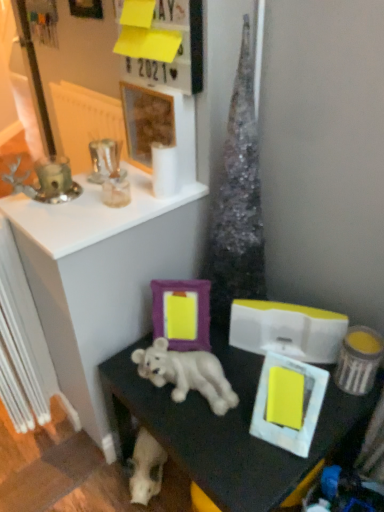
Question: Is metallic silver picture frame at upper left, which is the 4th picture frame in front-to-back order, oriented away from white matte skull at lower center?

Choices:
 (A) no
 (B) yes

Answer: (A)

Question: Is the position of metallic silver picture frame at upper left, which appears as the 1th picture frame when viewed from the back, more distant than that of white matte skull at lower center?

Choices:
 (A) no
 (B) yes

Answer: (B)

Question: Is white matte skull at lower center inside metallic silver picture frame at upper left, which is counted as the 1th picture frame, starting from the left?

Choices:
 (A) no
 (B) yes

Answer: (A)

Question: From the image's perspective, would you say metallic silver picture frame at upper left, which is the 4th picture frame in front-to-back order, is shown under white matte skull at lower center?

Choices:
 (A) yes
 (B) no

Answer: (B)

Question: From a real-world perspective, is metallic silver picture frame at upper left, which is counted as the 1th picture frame, starting from the left, positioned under white matte skull at lower center based on gravity?

Choices:
 (A) yes
 (B) no

Answer: (B)

Question: From the image's perspective, is metallic silver picture frame at upper left, which appears as the 1th picture frame when viewed from the back, located above white matte skull at lower center?

Choices:
 (A) no
 (B) yes

Answer: (B)

Question: Could you tell me if wooden frame at upper center, placed as the 2th picture frame when sorted from top to bottom, is facing silver metallic candle holder at upper left?

Choices:
 (A) yes
 (B) no

Answer: (A)

Question: Is the depth of wooden frame at upper center, acting as the 3th picture frame starting from the back, greater than that of silver metallic candle holder at upper left?

Choices:
 (A) yes
 (B) no

Answer: (A)

Question: Considering the relative sizes of wooden frame at upper center, acting as the 3th picture frame starting from the back, and silver metallic candle holder at upper left in the image provided, is wooden frame at upper center, acting as the 3th picture frame starting from the back, smaller than silver metallic candle holder at upper left?

Choices:
 (A) no
 (B) yes

Answer: (A)

Question: Considering the relative sizes of wooden frame at upper center, which appears as the third picture frame when viewed from the right, and silver metallic candle holder at upper left in the image provided, is wooden frame at upper center, which appears as the third picture frame when viewed from the right, wider than silver metallic candle holder at upper left?

Choices:
 (A) no
 (B) yes

Answer: (A)

Question: Can you confirm if wooden frame at upper center, arranged as the 3th picture frame when ordered from the bottom, is bigger than silver metallic candle holder at upper left?

Choices:
 (A) yes
 (B) no

Answer: (A)

Question: Are wooden frame at upper center, acting as the 3th picture frame starting from the back, and silver metallic candle holder at upper left located far from each other?

Choices:
 (A) yes
 (B) no

Answer: (B)

Question: Is white matte picture frame at lower right, which appears as the first picture frame when viewed from the front, not within wooden frame at upper center, acting as the 3th picture frame starting from the back?

Choices:
 (A) no
 (B) yes

Answer: (B)